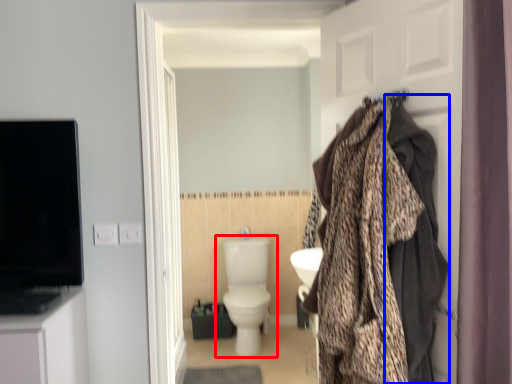
Question: Which object is further to the camera taking this photo, toilet (highlighted by a red box) or blanket (highlighted by a blue box)?

Choices:
 (A) toilet
 (B) blanket

Answer: (A)